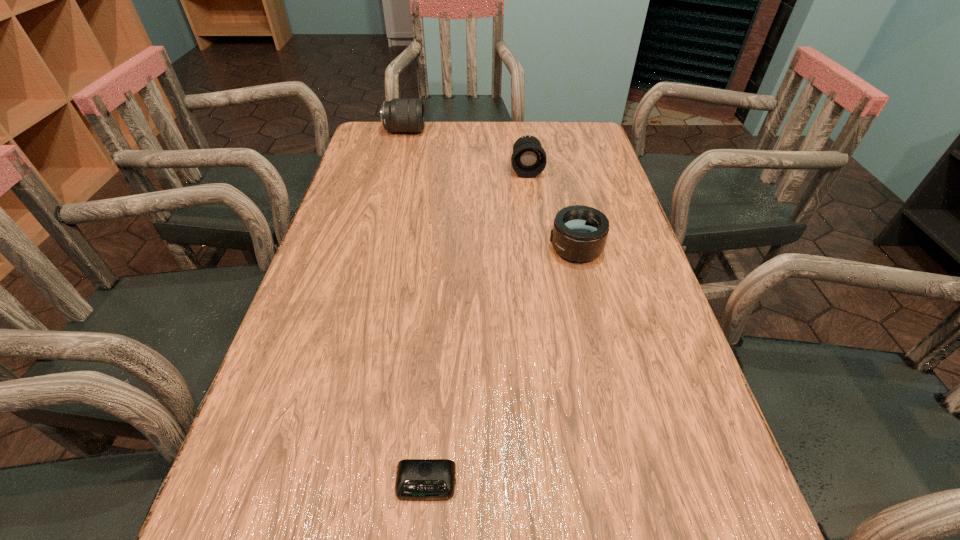
Identify the location of vacant area that lies between the second farthest telephoto lens and the third object from right to left. This screenshot has height=540, width=960. (476, 326).

The image size is (960, 540). In order to click on vacant area that lies between the third nearest object and the shortest telephoto lens in this screenshot , I will do `click(551, 209)`.

The height and width of the screenshot is (540, 960). What are the coordinates of `free space between the leftmost telephoto lens and the third farthest object` in the screenshot? It's located at (491, 190).

Locate an element on the screen. The width and height of the screenshot is (960, 540). vacant point located between the second farthest telephoto lens and the second object from left to right is located at coordinates (476, 326).

Locate an element on the screen. The width and height of the screenshot is (960, 540). vacant point located between the second nearest telephoto lens and the third object from right to left is located at coordinates (476, 326).

Locate an element on the screen. vacant space that's between the nearest telephoto lens and the second farthest object is located at coordinates (551, 209).

Locate an element on the screen. This screenshot has width=960, height=540. blank region between the alarm clock and the third nearest object is located at coordinates (476, 326).

At what (x,y) coordinates should I click in order to perform the action: click on vacant space that is in between the second farthest object and the farthest object. Please return your answer as a coordinate pair (x, y). Looking at the image, I should click on (466, 150).

Find the location of a particular element. This screenshot has height=540, width=960. free point between the nearest telephoto lens and the third nearest object is located at coordinates (551, 209).

The image size is (960, 540). I want to click on vacant area that lies between the leftmost telephoto lens and the second nearest telephoto lens, so click(x=466, y=150).